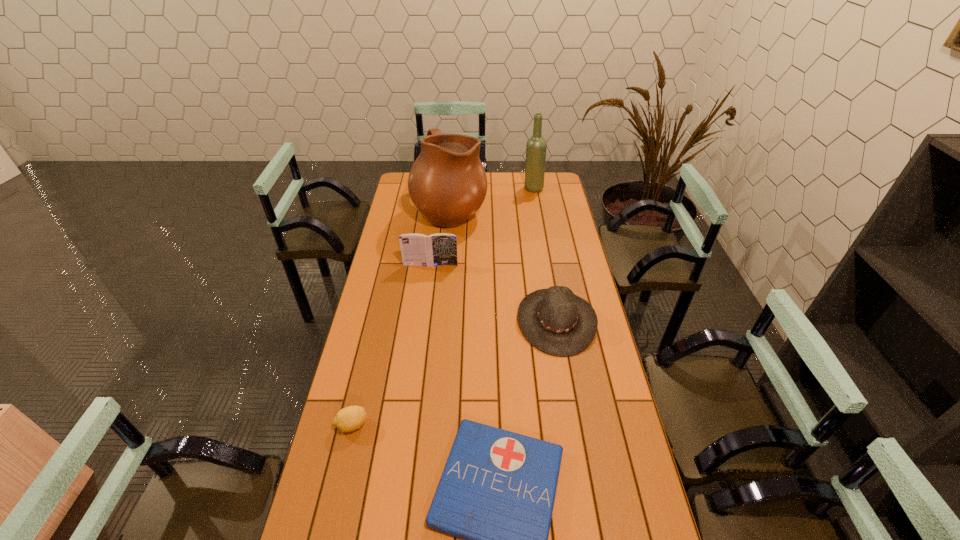
Identify the location of blank space located 0.300m on the front cover of the third tallest object. This screenshot has width=960, height=540. (423, 319).

The height and width of the screenshot is (540, 960). I want to click on free point located on the front-facing side of the hat, so click(422, 321).

At what (x,y) coordinates should I click in order to perform the action: click on vacant area situated 0.350m on the front-facing side of the hat. Please return your answer as a coordinate pair (x, y). This screenshot has width=960, height=540. Looking at the image, I should click on (424, 321).

Identify the location of free point located 0.150m on the front-facing side of the hat. (478, 321).

Locate an element on the screen. vacant point located at the stem end of the leftmost object is located at coordinates (441, 425).

Identify the location of cream pitcher situated at the far edge. (447, 183).

This screenshot has width=960, height=540. What are the coordinates of `wine bottle located at the far edge` in the screenshot? It's located at (536, 146).

The height and width of the screenshot is (540, 960). In order to click on cream pitcher at the left edge in this screenshot , I will do `click(447, 183)`.

The height and width of the screenshot is (540, 960). Identify the location of book located at the left edge. (437, 249).

Locate an element on the screen. lemon that is at the left edge is located at coordinates [x=348, y=419].